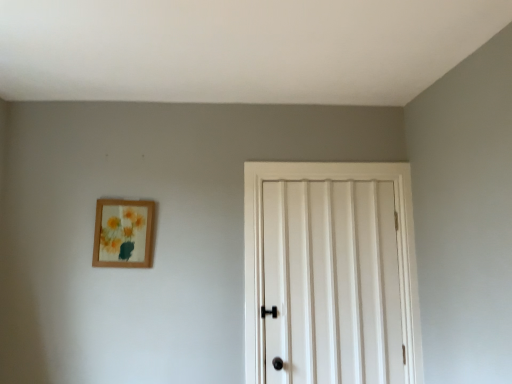
What are the coordinates of `white matte door at center` in the screenshot? It's located at (330, 274).

The width and height of the screenshot is (512, 384). What do you see at coordinates (330, 274) in the screenshot?
I see `white matte door at center` at bounding box center [330, 274].

The width and height of the screenshot is (512, 384). Identify the location of wooden picture frame at upper left. coord(124,233).

The width and height of the screenshot is (512, 384). What do you see at coordinates (124, 233) in the screenshot?
I see `wooden picture frame at upper left` at bounding box center [124, 233].

The width and height of the screenshot is (512, 384). Find the location of `white matte door at center`. white matte door at center is located at coordinates (330, 274).

Would you say white matte door at center is to the left or to the right of wooden picture frame at upper left in the picture?

From the image, it's evident that white matte door at center is to the right of wooden picture frame at upper left.

Is the position of white matte door at center more distant than that of wooden picture frame at upper left?

No, the depth of white matte door at center is less than that of wooden picture frame at upper left.

Does point (398, 194) lie behind point (118, 247)?

Yes, it is.

From the image's perspective, is white matte door at center located above wooden picture frame at upper left?

Actually, white matte door at center appears below wooden picture frame at upper left in the image.

From a real-world perspective, is white matte door at center beneath wooden picture frame at upper left?

Yes, from a real-world perspective, white matte door at center is beneath wooden picture frame at upper left.

Is white matte door at center thinner than wooden picture frame at upper left?

Incorrect, the width of white matte door at center is not less than that of wooden picture frame at upper left.

Who is shorter, white matte door at center or wooden picture frame at upper left?

wooden picture frame at upper left.

Considering the sizes of objects white matte door at center and wooden picture frame at upper left in the image provided, who is smaller, white matte door at center or wooden picture frame at upper left?

wooden picture frame at upper left is smaller.

Would you say white matte door at center is outside wooden picture frame at upper left?

Yes.

Is there a large distance between white matte door at center and wooden picture frame at upper left?

No, white matte door at center is not far from wooden picture frame at upper left.

Is wooden picture frame at upper left at the back of white matte door at center?

No, wooden picture frame at upper left is not at the back of white matte door at center.

Identify the location of picture frame above the white matte door at center (from the image's perspective). (124, 233).

Considering the relative positions of wooden picture frame at upper left and white matte door at center in the image provided, is wooden picture frame at upper left to the left of white matte door at center from the viewer's perspective?

Yes, wooden picture frame at upper left is to the left of white matte door at center.

Consider the image. Which object is further away from the camera, wooden picture frame at upper left or white matte door at center?

wooden picture frame at upper left is further from the camera.

Does point (149, 262) appear closer or farther from the camera than point (408, 304)?

Point (149, 262) is closer to the camera than point (408, 304).

From the image's perspective, between wooden picture frame at upper left and white matte door at center, who is located below?

white matte door at center is shown below in the image.

From a real-world perspective, is wooden picture frame at upper left positioned above or below white matte door at center?

wooden picture frame at upper left is situated higher than white matte door at center in the real world.

Considering the relative sizes of wooden picture frame at upper left and white matte door at center in the image provided, is wooden picture frame at upper left wider than white matte door at center?

In fact, wooden picture frame at upper left might be narrower than white matte door at center.

Is wooden picture frame at upper left taller or shorter than white matte door at center?

wooden picture frame at upper left is shorter than white matte door at center.

Who is bigger, wooden picture frame at upper left or white matte door at center?

With larger size is white matte door at center.

Is white matte door at center completely or partially inside wooden picture frame at upper left?

No, white matte door at center is not surrounded by wooden picture frame at upper left.

Looking at this image, is wooden picture frame at upper left beside white matte door at center?

No, wooden picture frame at upper left is not in contact with white matte door at center.

Consider the image. Is wooden picture frame at upper left turned away from white matte door at center?

No, wooden picture frame at upper left is not facing away from white matte door at center.

How different are the orientations of wooden picture frame at upper left and white matte door at center in degrees?

The angle between the facing direction of wooden picture frame at upper left and the facing direction of white matte door at center is 1.88 degrees.

There is a white matte door at center. At what (x,y) coordinates should I click in order to perform the action: click on picture frame above it (from a real-world perspective). Please return your answer as a coordinate pair (x, y). Image resolution: width=512 pixels, height=384 pixels. Looking at the image, I should click on (124, 233).

Identify the location of door on the right of the wooden picture frame at upper left. The height and width of the screenshot is (384, 512). (330, 274).

At what (x,y) coordinates should I click in order to perform the action: click on picture frame above the white matte door at center (from the image's perspective). Please return your answer as a coordinate pair (x, y). The image size is (512, 384). Looking at the image, I should click on [x=124, y=233].